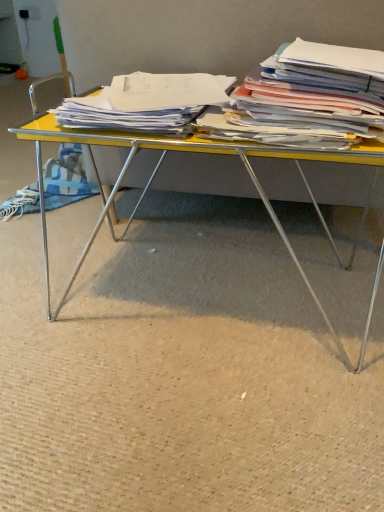
Where is `vacant space in front of yellow plastic desk at center`? This screenshot has width=384, height=512. vacant space in front of yellow plastic desk at center is located at coordinates (206, 414).